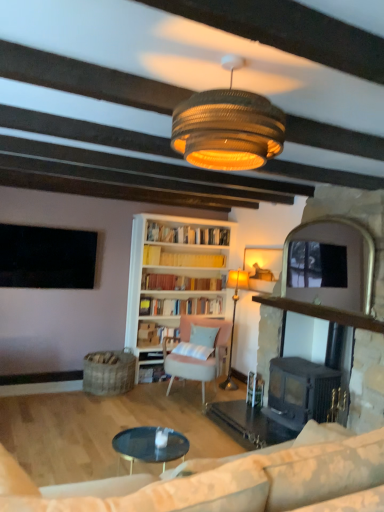
Question: From a real-world perspective, is braided wicker lampshade at center, acting as the 1th lamp starting from the front, physically located above or below pastel pink fabric chair at center?

Choices:
 (A) above
 (B) below

Answer: (A)

Question: In the image, is braided wicker lampshade at center, the second lamp in the back-to-front sequence, on the left side or the right side of pastel pink fabric chair at center?

Choices:
 (A) left
 (B) right

Answer: (B)

Question: Estimate the real-world distances between objects in this image. Which object is closer to the braided wicker lampshade at center, placed as the first lamp when sorted from top to bottom?

Choices:
 (A) black cast iron fireplace at center
 (B) beige fabric couch at lower right
 (C) light blue fabric pillow at center
 (D) black matte television at upper left
 (E) pastel pink fabric chair at center

Answer: (B)

Question: Which object is positioned closest to the yellow paperbacks at center, marked as the third book in a bottom-to-top arrangement?

Choices:
 (A) black matte television at upper left
 (B) black cast iron fireplace at center
 (C) braided wicker lampshade at center, placed as the first lamp when sorted from top to bottom
 (D) light blue fabric pillow at center
 (E) matte gold lamp at center, the 2th lamp when ordered from top to bottom

Answer: (E)